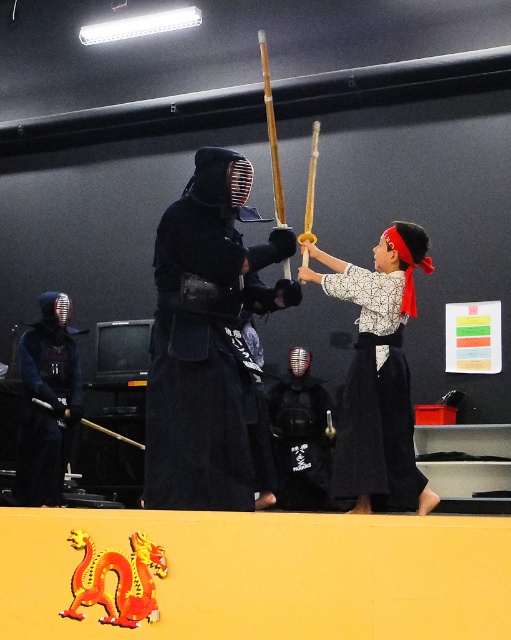
Question: Is black matte kimono at center smaller than white cotton kimono at center?

Choices:
 (A) yes
 (B) no

Answer: (B)

Question: Does black matte kimono at center have a greater width compared to matte black kendo helmet at left?

Choices:
 (A) yes
 (B) no

Answer: (A)

Question: Which of the following is the closest to the observer?

Choices:
 (A) matte black kendo helmet at left
 (B) white cotton kimono at center
 (C) black matte kimono at center

Answer: (C)

Question: Which point is farther to the camera?

Choices:
 (A) (217, 445)
 (B) (350, 426)
 (C) (48, 412)

Answer: (C)

Question: Can you confirm if black matte kimono at center is bigger than white cotton kimono at center?

Choices:
 (A) yes
 (B) no

Answer: (A)

Question: Which object appears farthest from the camera in this image?

Choices:
 (A) matte black kendo helmet at left
 (B) black matte kimono at center
 (C) white cotton kimono at center

Answer: (A)